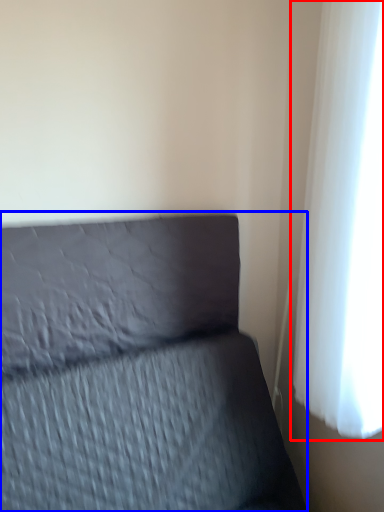
Question: Among these objects, which one is farthest to the camera, curtain (highlighted by a red box) or furniture (highlighted by a blue box)?

Choices:
 (A) curtain
 (B) furniture

Answer: (A)